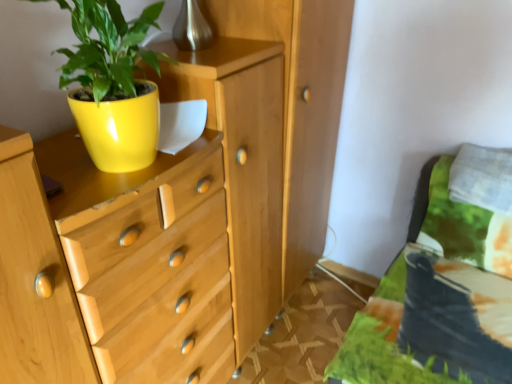
Question: Does white soft pillow at upper right appear on the left side of matte yellow pot at upper left?

Choices:
 (A) yes
 (B) no

Answer: (B)

Question: Considering the relative sizes of white soft pillow at upper right and matte yellow pot at upper left in the image provided, is white soft pillow at upper right taller than matte yellow pot at upper left?

Choices:
 (A) yes
 (B) no

Answer: (B)

Question: Is the surface of white soft pillow at upper right in direct contact with matte yellow pot at upper left?

Choices:
 (A) no
 (B) yes

Answer: (A)

Question: Can you confirm if white soft pillow at upper right is wider than matte yellow pot at upper left?

Choices:
 (A) yes
 (B) no

Answer: (A)

Question: Is the position of white soft pillow at upper right less distant than that of matte yellow pot at upper left?

Choices:
 (A) no
 (B) yes

Answer: (A)

Question: Is matte yellow pot at upper left surrounded by white soft pillow at upper right?

Choices:
 (A) yes
 (B) no

Answer: (B)

Question: Considering the relative sizes of matte yellow pot at upper left and white soft pillow at upper right in the image provided, is matte yellow pot at upper left smaller than white soft pillow at upper right?

Choices:
 (A) yes
 (B) no

Answer: (B)

Question: From the image's perspective, would you say matte yellow pot at upper left is positioned over white soft pillow at upper right?

Choices:
 (A) no
 (B) yes

Answer: (B)

Question: Does matte yellow pot at upper left have a lesser width compared to white soft pillow at upper right?

Choices:
 (A) no
 (B) yes

Answer: (B)

Question: Is matte yellow pot at upper left to the left of white soft pillow at upper right from the viewer's perspective?

Choices:
 (A) yes
 (B) no

Answer: (A)

Question: Considering the relative positions of matte yellow pot at upper left and white soft pillow at upper right in the image provided, is matte yellow pot at upper left to the right of white soft pillow at upper right from the viewer's perspective?

Choices:
 (A) yes
 (B) no

Answer: (B)

Question: Could white soft pillow at upper right be considered to be inside matte yellow pot at upper left?

Choices:
 (A) yes
 (B) no

Answer: (B)

Question: From a real-world perspective, is yellow glossy flowerpot at upper left beneath matte yellow pot at upper left?

Choices:
 (A) no
 (B) yes

Answer: (B)